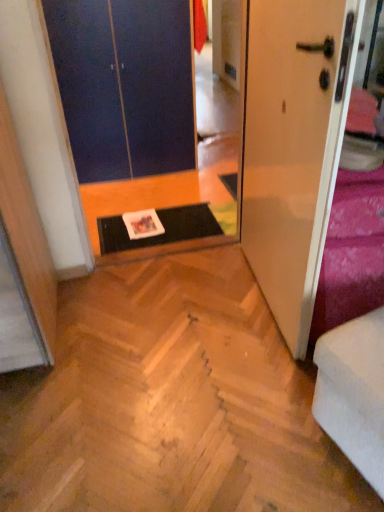
Where is `free space on the front side of white glossy door at right, the first door viewed from the front`? This screenshot has height=512, width=384. free space on the front side of white glossy door at right, the first door viewed from the front is located at coordinates (240, 382).